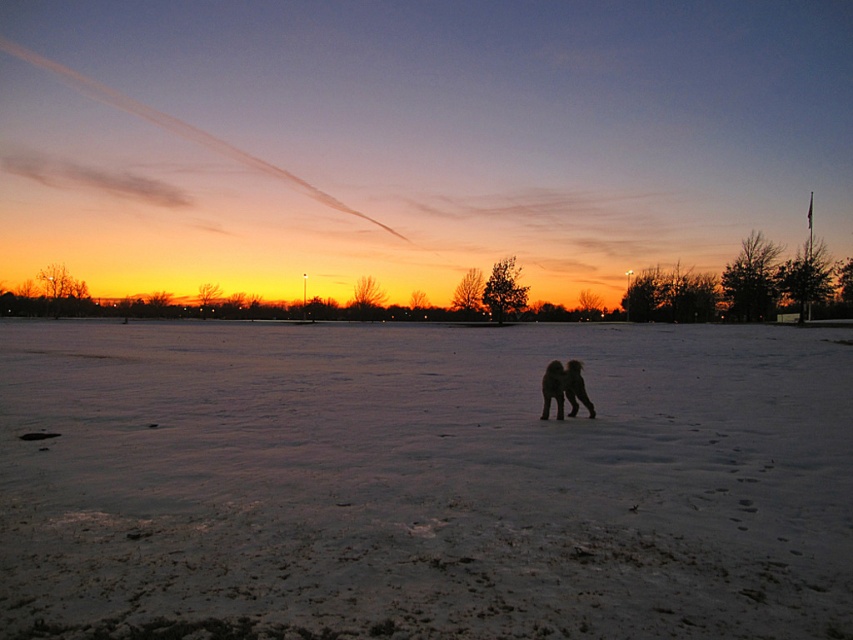
You are a hiker who wants to take a shortcut through the snow. You see the white powdery snow at center and the black fur dog at center. Which object is closer to you as you approach the scene?

The white powdery snow at center is closer to you because it is in front of the black fur dog at center.

You are a photographer standing at the edge of the snow field. You want to take a photo of the black fur dog at center and the white powdery snow at center in the same frame. Can you position yourself so that both are visible without moving either object? Explain your reasoning.

The distance between the white powdery snow at center and the black fur dog at center is 7.45 meters. Since the photographer can adjust their position to frame both objects within the camera view, it is possible to capture both in the same photo without moving the objects. The distance allows for a wide enough angle or appropriate zoom to include both subjects in the frame.

You are standing at the edge of the snow and want to walk towards the trees in the middle ground. Which direction should you walk to avoid stepping on the white powdery snow at center?

To avoid stepping on the white powdery snow at center, you should walk towards the trees in the middle ground in a direction away from the point at coordinates (422, 483).